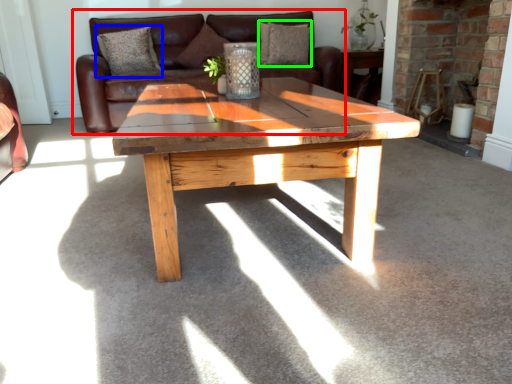
Question: Which is farther away from studio couch (highlighted by a red box)? pillow (highlighted by a blue box) or pillow (highlighted by a green box)?

Choices:
 (A) pillow
 (B) pillow

Answer: (B)